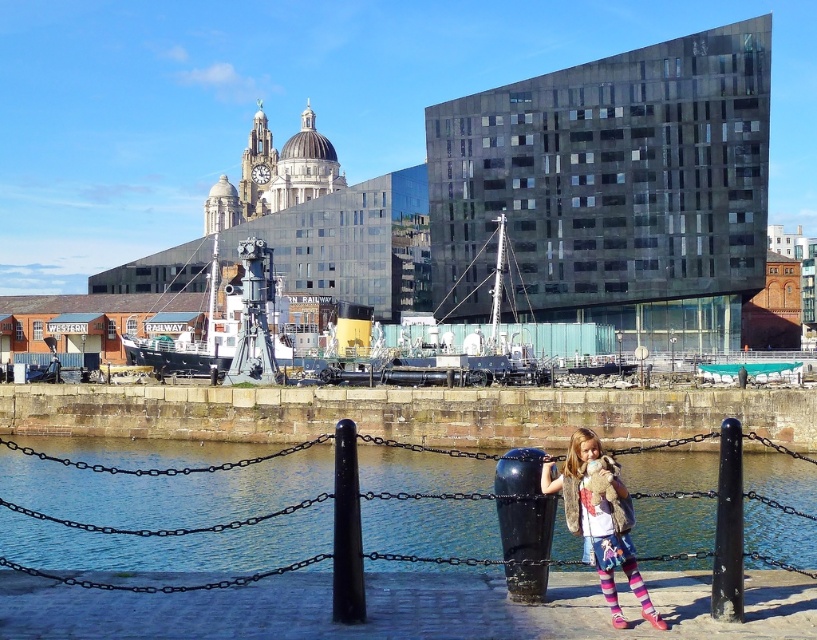
Is clear blue water at lower center to the left of black matte pole at lower right from the viewer's perspective?

Yes, clear blue water at lower center is to the left of black matte pole at lower right.

Who is higher up, clear blue water at lower center or black matte pole at lower right?

black matte pole at lower right is higher up.

Between point (164, 515) and point (720, 532), which one is positioned behind?

Point (164, 515)

Where is `clear blue water at lower center`? This screenshot has height=640, width=817. clear blue water at lower center is located at coordinates (166, 515).

Between point (206, 349) and point (726, 548), which one is positioned behind?

The point (206, 349) is more distant.

Is black metal ship at center bigger than black matte pole at lower right?

Correct, black metal ship at center is larger in size than black matte pole at lower right.

Which is behind, point (251, 376) or point (721, 588)?

Positioned behind is point (251, 376).

You are a GUI agent. You are given a task and a screenshot of the screen. Output one action in this format:
    pyautogui.click(x=<x>, y=<y>)
    Task: Click on the black metal ship at center
    The image size is (817, 640).
    Given the screenshot: What is the action you would take?
    pyautogui.click(x=230, y=326)

Find the location of `light brown fur vest at lower right`. light brown fur vest at lower right is located at coordinates (597, 518).

Is point (637, 589) positioned after point (730, 484)?

Yes, point (637, 589) is farther from viewer.

Measure the distance between point (576, 452) and camera.

A distance of 46.12 meters exists between point (576, 452) and camera.

In order to click on light brown fur vest at lower right in this screenshot , I will do `click(597, 518)`.